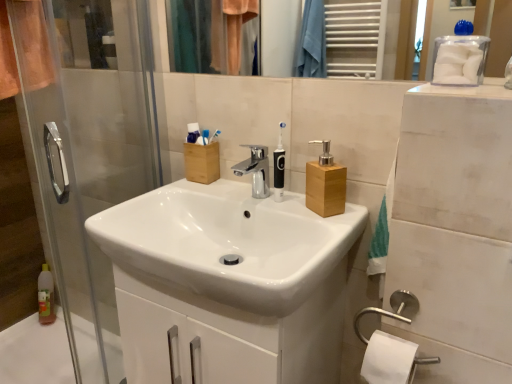
Question: Is white plastic toothbrush at upper center, the second toothbrush viewed from the front, completely or partially inside clear plastic bottle at lower left?

Choices:
 (A) no
 (B) yes

Answer: (A)

Question: Is clear plastic bottle at lower left aimed at white plastic toothbrush at upper center, which appears as the 2th toothbrush when viewed from the back?

Choices:
 (A) no
 (B) yes

Answer: (A)

Question: Is clear plastic bottle at lower left looking in the opposite direction of white plastic toothbrush at upper center, the 1th toothbrush positioned from the left?

Choices:
 (A) yes
 (B) no

Answer: (B)

Question: Is clear plastic bottle at lower left in contact with white plastic toothbrush at upper center, placed as the 3th toothbrush when sorted from right to left?

Choices:
 (A) yes
 (B) no

Answer: (B)

Question: Is clear plastic bottle at lower left further to camera compared to white plastic toothbrush at upper center, placed as the 3th toothbrush when sorted from right to left?

Choices:
 (A) no
 (B) yes

Answer: (B)

Question: In the image, is transparent glass screen door at left on the left side or the right side of matte plastic toothbrushes at upper center?

Choices:
 (A) right
 (B) left

Answer: (B)

Question: In the image, is transparent glass screen door at left positioned in front of or behind matte plastic toothbrushes at upper center?

Choices:
 (A) front
 (B) behind

Answer: (A)

Question: Looking at their shapes, would you say transparent glass screen door at left is wider or thinner than matte plastic toothbrushes at upper center?

Choices:
 (A) thin
 (B) wide

Answer: (B)

Question: Considering the positions of transparent glass screen door at left and matte plastic toothbrushes at upper center in the image, is transparent glass screen door at left taller or shorter than matte plastic toothbrushes at upper center?

Choices:
 (A) tall
 (B) short

Answer: (A)

Question: Looking at the image, does transparent glass screen door at left seem bigger or smaller compared to clear plastic bottle at lower left?

Choices:
 (A) small
 (B) big

Answer: (B)

Question: Relative to clear plastic bottle at lower left, is transparent glass screen door at left in front or behind?

Choices:
 (A) behind
 (B) front

Answer: (B)

Question: Is point (129, 64) closer or farther from the camera than point (33, 332)?

Choices:
 (A) farther
 (B) closer

Answer: (B)

Question: Considering the positions of transparent glass screen door at left and clear plastic bottle at lower left in the image, is transparent glass screen door at left wider or thinner than clear plastic bottle at lower left?

Choices:
 (A) thin
 (B) wide

Answer: (A)

Question: From a real-world perspective, is wooden soap dispenser at center positioned above or below satin nickel towel bar at lower right?

Choices:
 (A) above
 (B) below

Answer: (A)

Question: Is point (306, 163) closer or farther from the camera than point (382, 314)?

Choices:
 (A) farther
 (B) closer

Answer: (A)